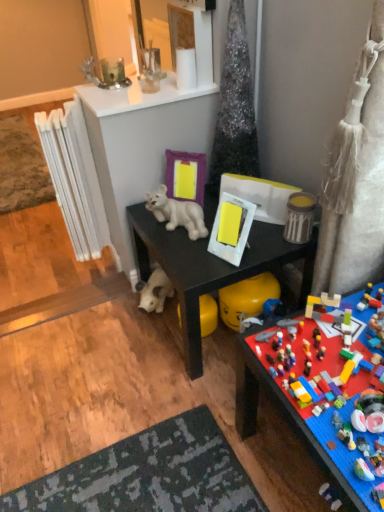
Locate an element on the screen. free space to the left of clear glass container at upper center, arranged as the 5th toy when ordered from the bottom is located at coordinates (123, 93).